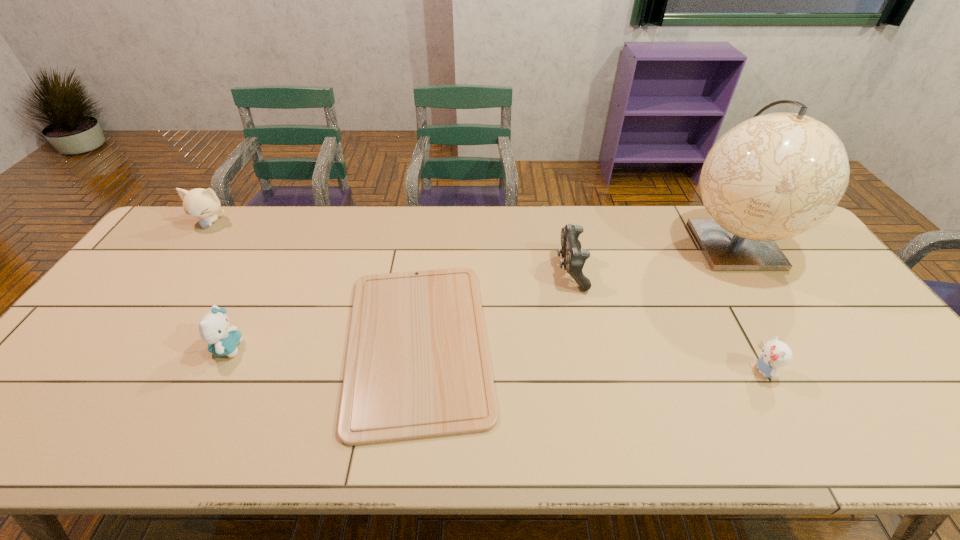
The image size is (960, 540). I want to click on vacant point located 0.270m on the face of the leftmost kitten, so click(x=161, y=289).

Locate an element on the screen. vacant area located 0.350m on the surface of the control with buttons is located at coordinates (441, 269).

I want to click on vacant space situated on the surface of the control with buttons, so (x=464, y=269).

Where is `vacant area located on the surface of the control with buttons`? vacant area located on the surface of the control with buttons is located at coordinates (500, 269).

You are a GUI agent. You are given a task and a screenshot of the screen. Output one action in this format:
    pyautogui.click(x=<x>, y=<y>)
    Task: Click on the vacant area located on the face of the second kitten from left to right
    
    Given the screenshot: What is the action you would take?
    pyautogui.click(x=301, y=348)

Locate an element on the screen. vacant region located on the front-facing side of the fifth tallest object is located at coordinates (628, 370).

The width and height of the screenshot is (960, 540). What are the coordinates of `free spot located 0.260m on the front-facing side of the fifth tallest object` in the screenshot? It's located at (644, 370).

Locate an element on the screen. Image resolution: width=960 pixels, height=540 pixels. free space located 0.050m on the front-facing side of the fifth tallest object is located at coordinates (731, 370).

Where is `free space located 0.400m on the left of the shortest object`? The width and height of the screenshot is (960, 540). free space located 0.400m on the left of the shortest object is located at coordinates (184, 343).

Find the location of `globe that is at the far edge`. globe that is at the far edge is located at coordinates (772, 177).